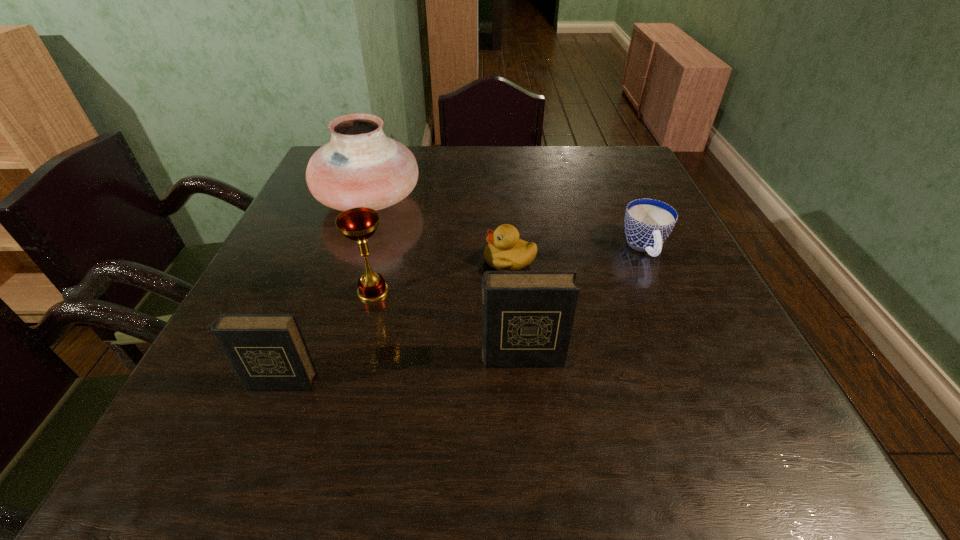
In the current image, all diarys are evenly spaced. To maintain this equal spacing, where should an additional diary be placed on the right? Please point out a free spot. Please provide its 2D coordinates. Your answer should be formatted as a tuple, i.e. [(x, y)], where the tuple contains the x and y coordinates of a point satisfying the conditions above.

[(741, 336)]